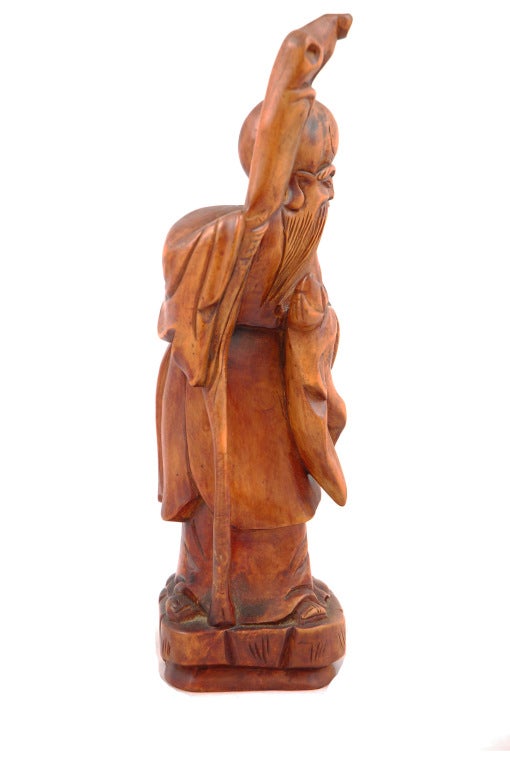
Image resolution: width=510 pixels, height=768 pixels. Identify the location of orange figurine. 253,395.